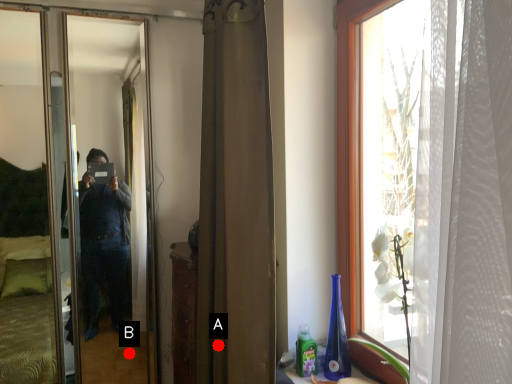
Question: Two points are circled on the image, labeled by A and B beside each circle. Among these points, which one is nearest to the camera?

Choices:
 (A) A is closer
 (B) B is closer

Answer: (A)